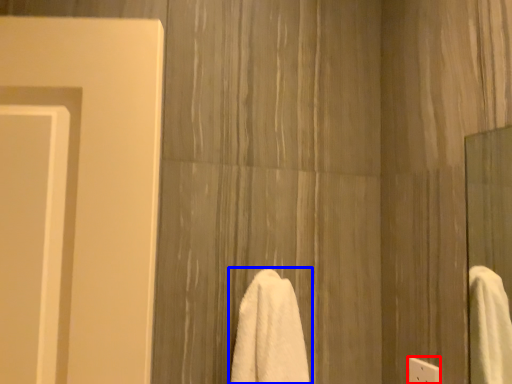
Question: Which object appears closest to the camera in this image, electric outlet (highlighted by a red box) or towel (highlighted by a blue box)?

Choices:
 (A) electric outlet
 (B) towel

Answer: (B)